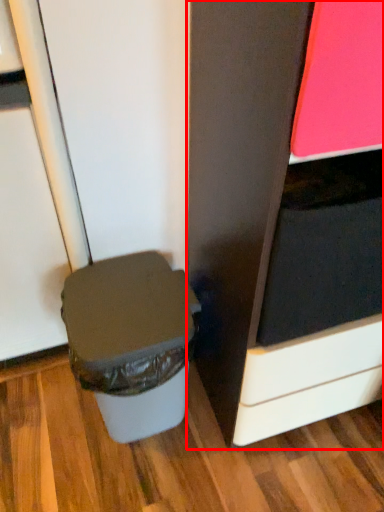
Question: Observing the image, what is the correct spatial positioning of cabinetry (annotated by the red box) in reference to waste container?

Choices:
 (A) left
 (B) right

Answer: (B)